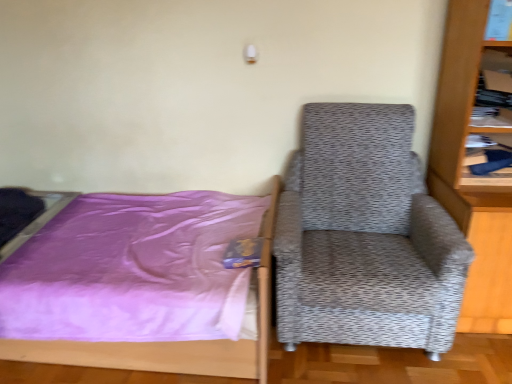
Question: Can you confirm if gray textured armchair at right is bigger than wooden bookcase at right?

Choices:
 (A) yes
 (B) no

Answer: (A)

Question: Is gray textured armchair at right to the left of wooden bookcase at right from the viewer's perspective?

Choices:
 (A) no
 (B) yes

Answer: (B)

Question: From the image's perspective, is gray textured armchair at right under wooden bookcase at right?

Choices:
 (A) yes
 (B) no

Answer: (A)

Question: From a real-world perspective, is gray textured armchair at right beneath wooden bookcase at right?

Choices:
 (A) yes
 (B) no

Answer: (A)

Question: From a real-world perspective, is gray textured armchair at right positioned over wooden bookcase at right based on gravity?

Choices:
 (A) no
 (B) yes

Answer: (A)

Question: Is gray textured armchair at right aimed at wooden bookcase at right?

Choices:
 (A) no
 (B) yes

Answer: (A)

Question: Is purple satin bed at left to the left of wooden bookcase at right from the viewer's perspective?

Choices:
 (A) no
 (B) yes

Answer: (B)

Question: Can you confirm if purple satin bed at left is thinner than wooden bookcase at right?

Choices:
 (A) yes
 (B) no

Answer: (B)

Question: Does purple satin bed at left have a larger size compared to wooden bookcase at right?

Choices:
 (A) no
 (B) yes

Answer: (B)

Question: Can you see purple satin bed at left touching wooden bookcase at right?

Choices:
 (A) no
 (B) yes

Answer: (A)

Question: Is purple satin bed at left completely or partially outside of wooden bookcase at right?

Choices:
 (A) yes
 (B) no

Answer: (A)

Question: Is purple satin bed at left in front of wooden bookcase at right?

Choices:
 (A) no
 (B) yes

Answer: (A)

Question: Does wooden bookshelf at upper right appear on the right side of wooden bookcase at right?

Choices:
 (A) yes
 (B) no

Answer: (B)